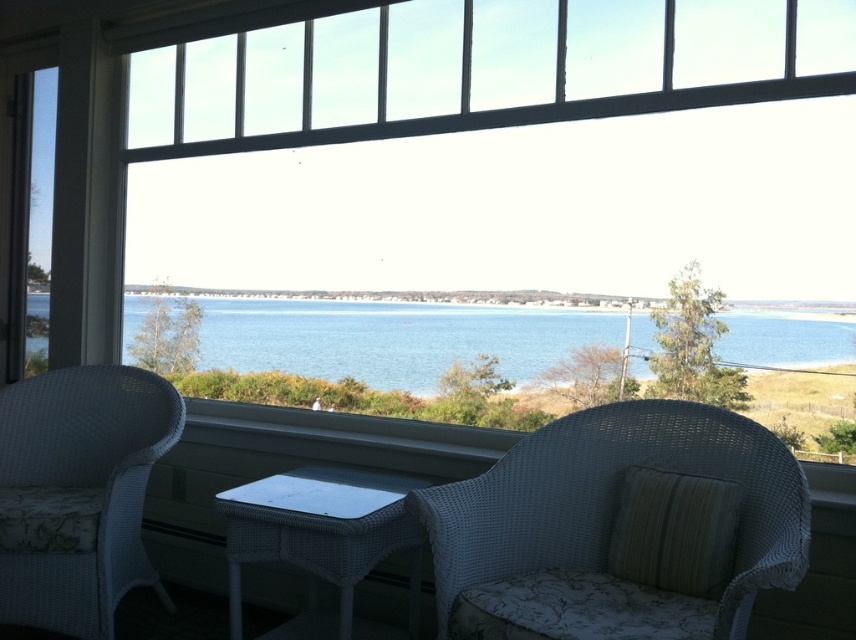
Question: Can you confirm if transparent glass window at center is bigger than white wicker armchair at center?

Choices:
 (A) yes
 (B) no

Answer: (A)

Question: Is transparent glass window at center wider than blue water at center?

Choices:
 (A) no
 (B) yes

Answer: (B)

Question: Estimate the real-world distances between objects in this image. Which object is closer to the white wicker table at center?

Choices:
 (A) white wicker armchair at left
 (B) transparent glass window at center
 (C) blue water at center
 (D) white wicker armchair at center

Answer: (D)

Question: Is white wicker armchair at left further to camera compared to blue water at center?

Choices:
 (A) yes
 (B) no

Answer: (A)

Question: Which object appears farthest from the camera in this image?

Choices:
 (A) transparent glass window at center
 (B) blue water at center
 (C) white wicker table at center
 (D) white wicker armchair at center

Answer: (B)

Question: Which object is the closest to the white wicker table at center?

Choices:
 (A) white wicker armchair at center
 (B) transparent glass window at center
 (C) white wicker armchair at left
 (D) blue water at center

Answer: (A)